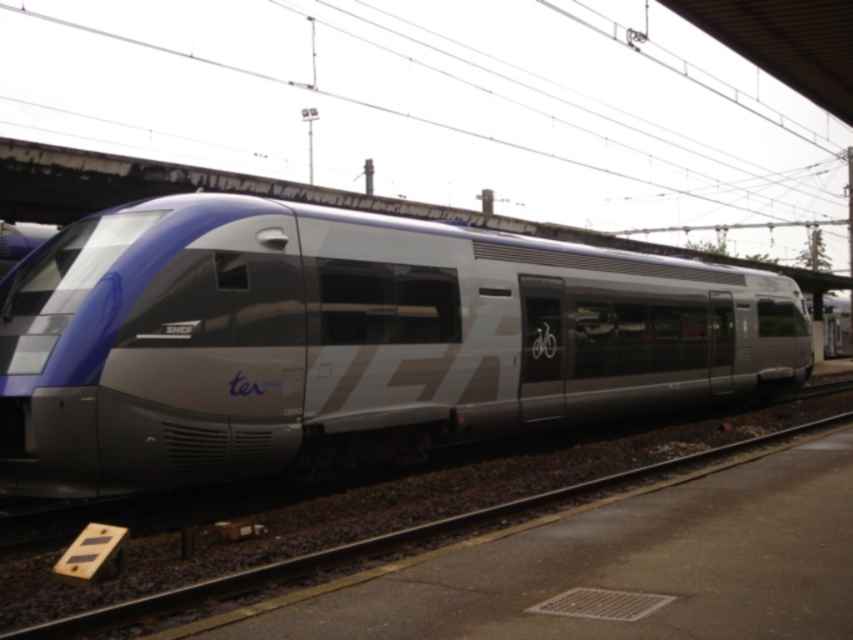
Question: Observing the image, what is the correct spatial positioning of matte silver train at center in reference to metallic train track at center?

Choices:
 (A) below
 (B) above

Answer: (B)

Question: Can you confirm if matte silver train at center is smaller than metallic train track at center?

Choices:
 (A) no
 (B) yes

Answer: (A)

Question: Which point is farther from the camera taking this photo?

Choices:
 (A) (184, 554)
 (B) (312, 424)

Answer: (B)

Question: Does matte silver train at center have a greater width compared to metallic train track at center?

Choices:
 (A) no
 (B) yes

Answer: (B)